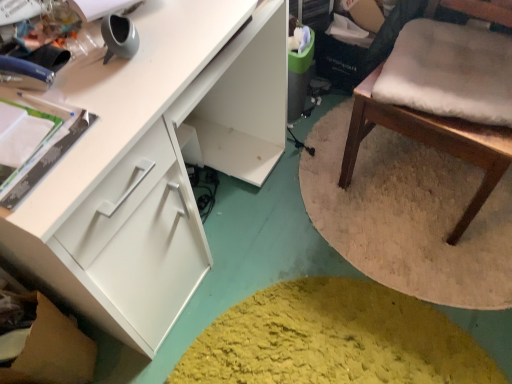
Find the location of a particular element. The width and height of the screenshot is (512, 384). vacant space underneath wooden chair with white cushion at right (from a real-world perspective) is located at coordinates (417, 188).